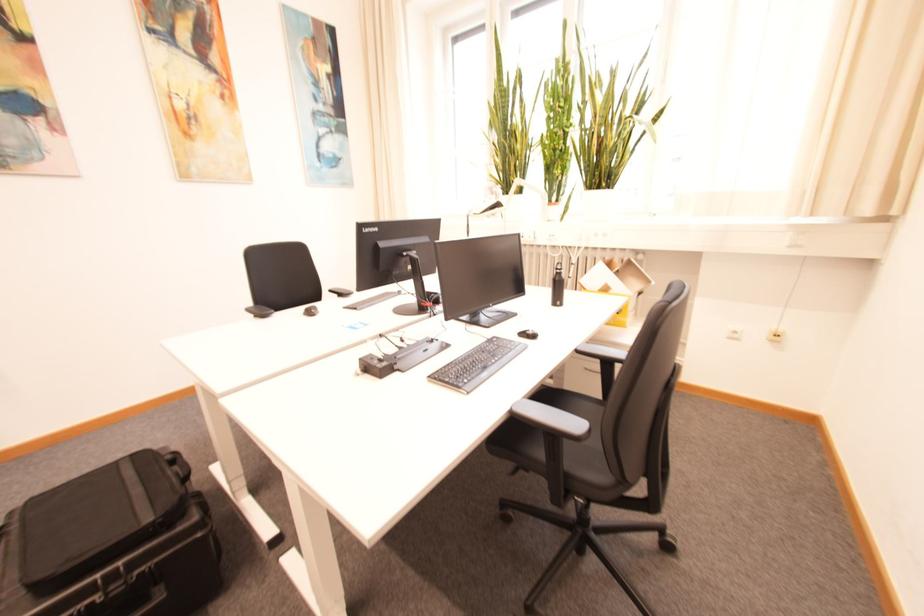
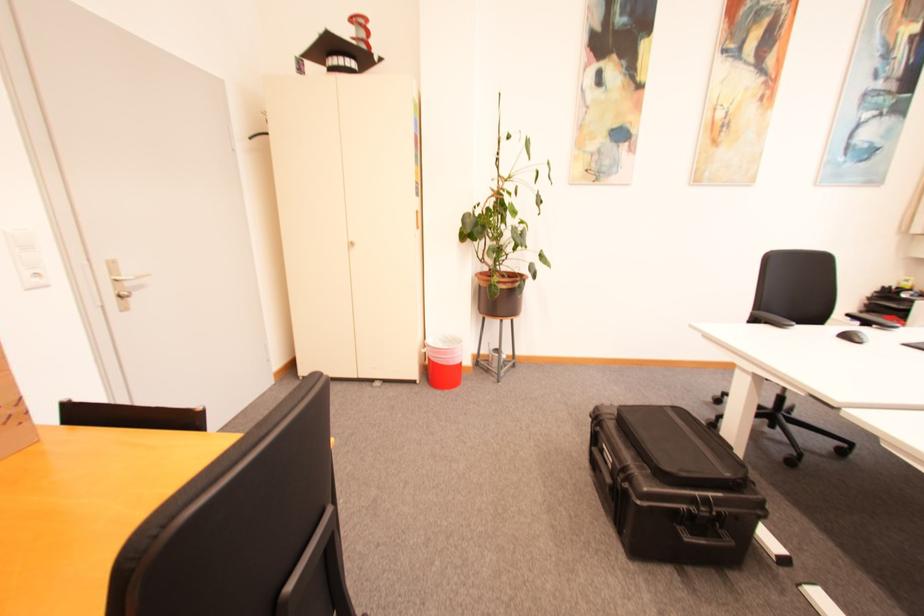
Find the pixel in the second image that matches (319,315) in the first image.

(865, 342)